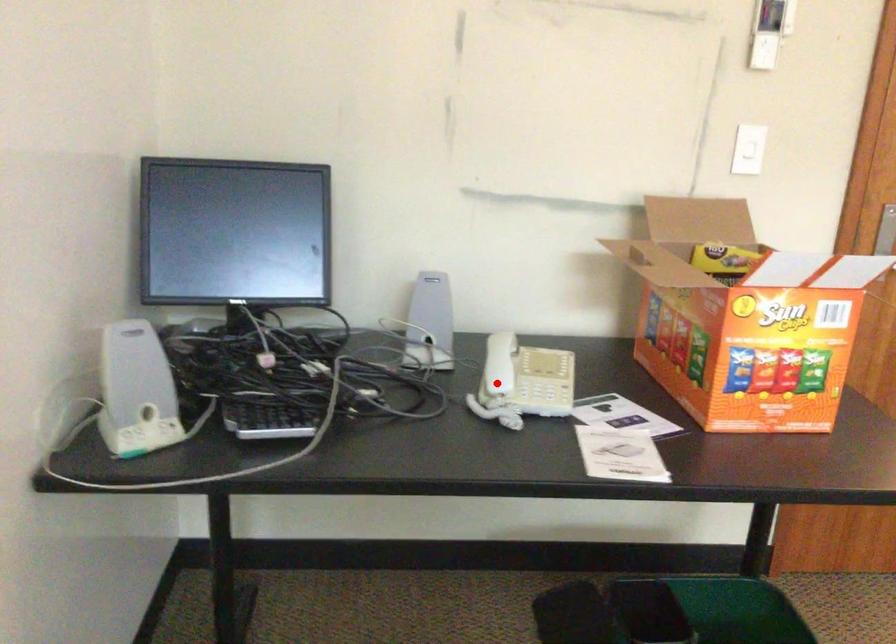
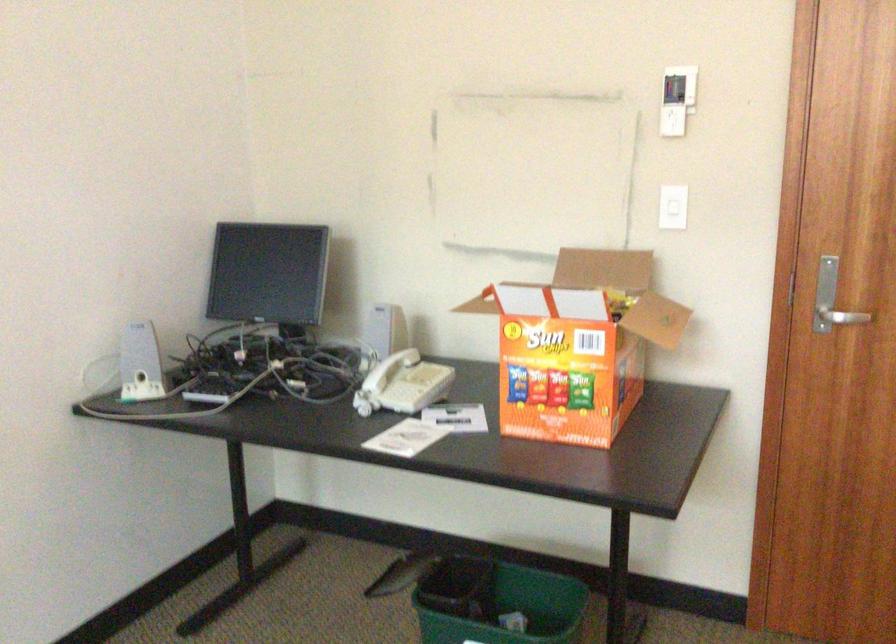
Question: I am providing you with two images of the same scene from different viewpoints. In image1, a red point is highlighted. Considering the same 3D point in image2, which of the following is correct?

Choices:
 (A) It is closer
 (B) It is farther

Answer: (B)